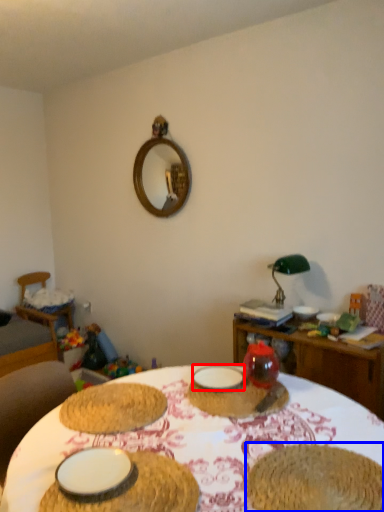
Question: Which object is further to the camera taking this photo, tableware (highlighted by a red box) or food (highlighted by a blue box)?

Choices:
 (A) tableware
 (B) food

Answer: (A)